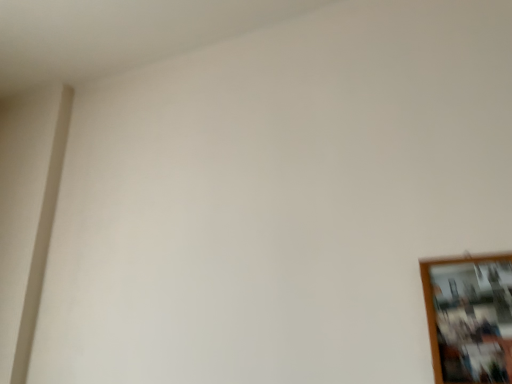
Question: Should I look upward or downward to see wooden picture frame at lower right?

Choices:
 (A) up
 (B) down

Answer: (B)